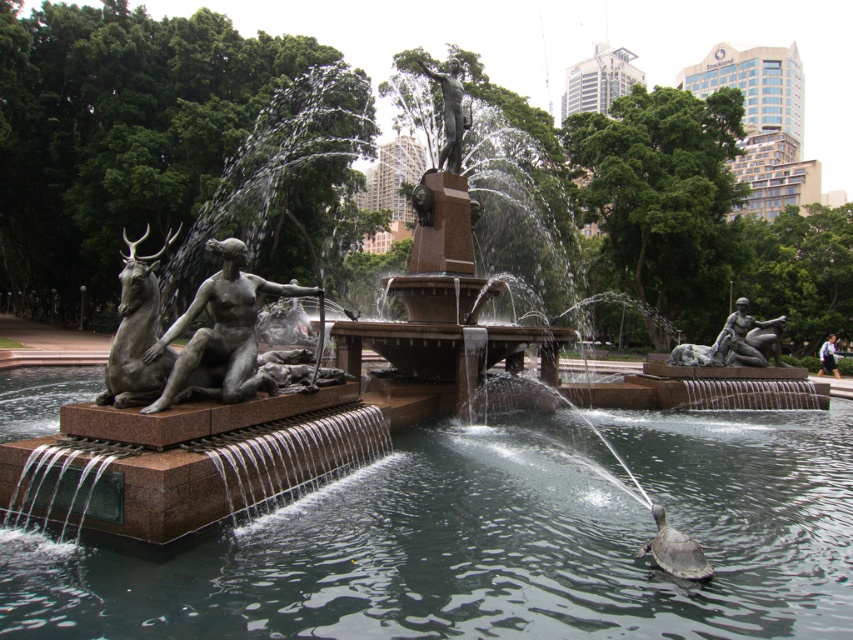
Question: Which point is closer to the camera?

Choices:
 (A) (683, 568)
 (B) (460, 140)
 (C) (135, 272)
 (D) (741, 362)

Answer: (A)

Question: Is bronze textured deer at left positioned in front of bronze statue at right?

Choices:
 (A) no
 (B) yes

Answer: (B)

Question: Can you confirm if polished stone water at center is smaller than bronze statue at right?

Choices:
 (A) yes
 (B) no

Answer: (A)

Question: Is bronze statue at right bigger than shiny gray turtle at lower right?

Choices:
 (A) yes
 (B) no

Answer: (A)

Question: Which object appears farthest from the camera in this image?

Choices:
 (A) polished stone water at center
 (B) bronze textured deer at left
 (C) bronze statue at right
 (D) bronze statue at center

Answer: (C)

Question: Which point is closer to the camera?

Choices:
 (A) bronze statue at upper center
 (B) polished stone water at center
 (C) shiny gray turtle at lower right
 (D) bronze textured deer at left

Answer: (B)